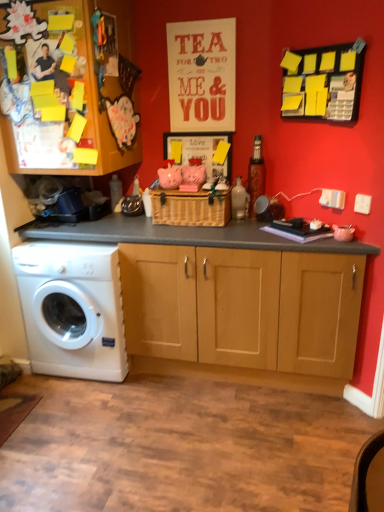
Measure the distance between point (81, 331) and camera.

Point (81, 331) is 2.57 meters away from camera.

Where is `wooden cabinet at center`? The image size is (384, 512). wooden cabinet at center is located at coordinates (65, 89).

Locate an element on the screen. white plastic washing machine at lower left is located at coordinates (72, 309).

From a real-world perspective, is white plastic washing machine at lower left positioned over woven brown basket at center based on gravity?

No, from a real-world perspective, white plastic washing machine at lower left is not over woven brown basket at center

Are white plastic washing machine at lower left and woven brown basket at center far apart?

No.

Which is more to the right, white plastic washing machine at lower left or woven brown basket at center?

woven brown basket at center is more to the right.

From the image's perspective, between white plastic washing machine at lower left and woven brown basket at center, who is located below?

From the image's view, white plastic washing machine at lower left is below.

Between point (202, 225) and point (324, 53), which one is positioned behind?

The point (202, 225) is farther from the camera.

Looking at this image, is woven brown basket at center oriented away from yellow sticky notes at upper right?

No, woven brown basket at center's orientation is not away from yellow sticky notes at upper right.

How far apart are woven brown basket at center and yellow sticky notes at upper right?

The distance of woven brown basket at center from yellow sticky notes at upper right is 30.11 inches.

From the image's perspective, is woven brown basket at center below yellow sticky notes at upper right?

Indeed, from the image's perspective, woven brown basket at center is shown beneath yellow sticky notes at upper right.

Which of these two, white plastic washing machine at lower left or wooden cabinet at center, is thinner?

white plastic washing machine at lower left.

Is wooden cabinet at center a part of white plastic washing machine at lower left?

Actually, wooden cabinet at center is outside white plastic washing machine at lower left.

Considering the positions of objects white plastic washing machine at lower left and wooden cabinet at center in the image provided, who is in front, white plastic washing machine at lower left or wooden cabinet at center?

Positioned in front is wooden cabinet at center.

Would you say white plastic washing machine at lower left is a long distance from wooden cabinet at center?

No, white plastic washing machine at lower left is not far from wooden cabinet at center.

Is white plastic washing machine at lower left oriented away from yellow sticky notes at upper right?

white plastic washing machine at lower left is not turned away from yellow sticky notes at upper right.

Can you confirm if white plastic washing machine at lower left is taller than yellow sticky notes at upper right?

Yes.

Does point (89, 278) come farther from viewer compared to point (336, 58)?

Yes, it is.

Who is smaller, wooden cabinet at center or white plastic washing machine at lower left?

Smaller between the two is white plastic washing machine at lower left.

Would you say wooden cabinet at center is outside white plastic washing machine at lower left?

Yes.

Based on the photo, is wooden cabinet at center turned away from white plastic washing machine at lower left?

No.

In the image, is wooden cabinet at center on the left side or the right side of white plastic washing machine at lower left?

In the image, wooden cabinet at center appears on the right side of white plastic washing machine at lower left.

Where is `bulletin board located in front of the wooden cabinet at center`? bulletin board located in front of the wooden cabinet at center is located at coordinates (323, 82).

Is wooden cabinet at center not near yellow sticky notes at upper right?

wooden cabinet at center is positioned a significant distance from yellow sticky notes at upper right.

How different are the orientations of wooden cabinet at center and yellow sticky notes at upper right in degrees?

132 degrees.

Is wooden cabinet at center situated inside yellow sticky notes at upper right or outside?

wooden cabinet at center exists outside the volume of yellow sticky notes at upper right.

From the image's perspective, is wooden cabinet at center positioned above or below woven brown basket at center?

From the image's perspective, wooden cabinet at center appears above woven brown basket at center.

Is wooden cabinet at center in front of or behind woven brown basket at center in the image?

Clearly, wooden cabinet at center is in front of woven brown basket at center.

Is wooden cabinet at center outside of woven brown basket at center?

Yes, wooden cabinet at center is outside of woven brown basket at center.

Find the location of a particular element. This screenshot has width=384, height=512. washing machine below the woven brown basket at center (from a real-world perspective) is located at coordinates (72, 309).

Identify the location of bulletin board lying on the right of woven brown basket at center. (323, 82).

Considering their positions, is white plastic washing machine at lower left positioned closer to yellow sticky notes at upper right than wooden cabinet at center?

wooden cabinet at center is closer to yellow sticky notes at upper right.

Based on their spatial positions, is white plastic washing machine at lower left or woven brown basket at center further from wooden cabinet at center?

white plastic washing machine at lower left lies further to wooden cabinet at center than the other object.

Considering their positions, is white plastic washing machine at lower left positioned further to woven brown basket at center than wooden cabinet at center?

Among the two, white plastic washing machine at lower left is located further to woven brown basket at center.

Based on their spatial positions, is wooden cabinet at center or woven brown basket at center closer to white plastic washing machine at lower left?

woven brown basket at center is positioned closer to the anchor white plastic washing machine at lower left.

Estimate the real-world distances between objects in this image. Which object is further from wooden cabinet at center, woven brown basket at center or white plastic washing machine at lower left?

Based on the image, white plastic washing machine at lower left appears to be further to wooden cabinet at center.

Considering their positions, is woven brown basket at center positioned closer to white plastic washing machine at lower left than wooden cabinet at center?

woven brown basket at center lies closer to white plastic washing machine at lower left than the other object.

From the image, which object appears to be farther from wooden cabinet at center, yellow sticky notes at upper right or white plastic washing machine at lower left?

yellow sticky notes at upper right is further to wooden cabinet at center.

Considering their positions, is white plastic washing machine at lower left positioned further to wooden cabinet at center than yellow sticky notes at upper right?

yellow sticky notes at upper right.

Where is `basket between white plastic washing machine at lower left and yellow sticky notes at upper right`? This screenshot has height=512, width=384. basket between white plastic washing machine at lower left and yellow sticky notes at upper right is located at coordinates (191, 208).

Locate an element on the screen. This screenshot has width=384, height=512. basket between wooden cabinet at center and white plastic washing machine at lower left in the up-down direction is located at coordinates (191, 208).

Find the location of a particular element. This screenshot has height=512, width=384. cabinetry situated between white plastic washing machine at lower left and yellow sticky notes at upper right from left to right is located at coordinates (65, 89).

You are a GUI agent. You are given a task and a screenshot of the screen. Output one action in this format:
    pyautogui.click(x=<x>, y=<y>)
    Task: Click on the basket between wooden cabinet at center and yellow sticky notes at upper right
    This screenshot has width=384, height=512.
    Given the screenshot: What is the action you would take?
    pyautogui.click(x=191, y=208)